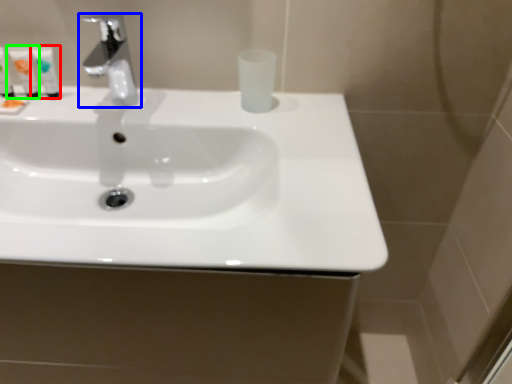
Question: Estimate the real-world distances between objects in this image. Which object is farther from mouthwash (highlighted by a red box), tap (highlighted by a blue box) or mouthwash (highlighted by a green box)?

Choices:
 (A) tap
 (B) mouthwash

Answer: (A)